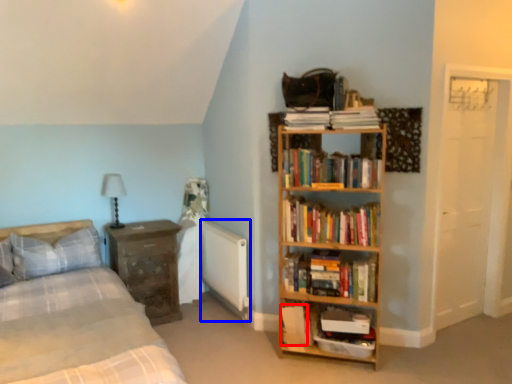
Question: Which object is closer to the camera taking this photo, paperback book (highlighted by a red box) or radiator (highlighted by a blue box)?

Choices:
 (A) paperback book
 (B) radiator

Answer: (A)